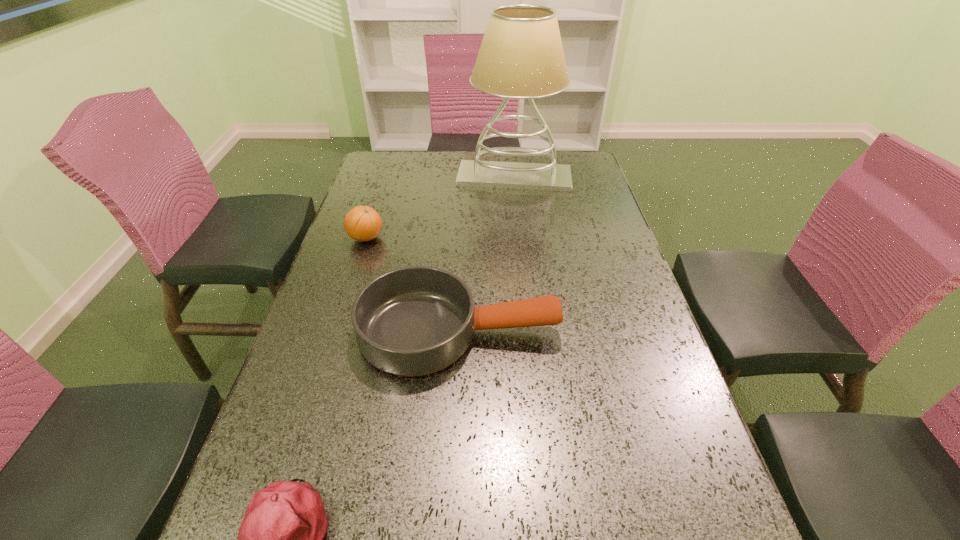
The width and height of the screenshot is (960, 540). Find the location of `object that is the fourth closest to the pan`. object that is the fourth closest to the pan is located at coordinates 521,56.

Point out which object is positioned as the third nearest to the baseball cap. Please provide its 2D coordinates. Your answer should be formatted as a tuple, i.e. [(x, y)], where the tuple contains the x and y coordinates of a point satisfying the conditions above.

[(362, 223)]